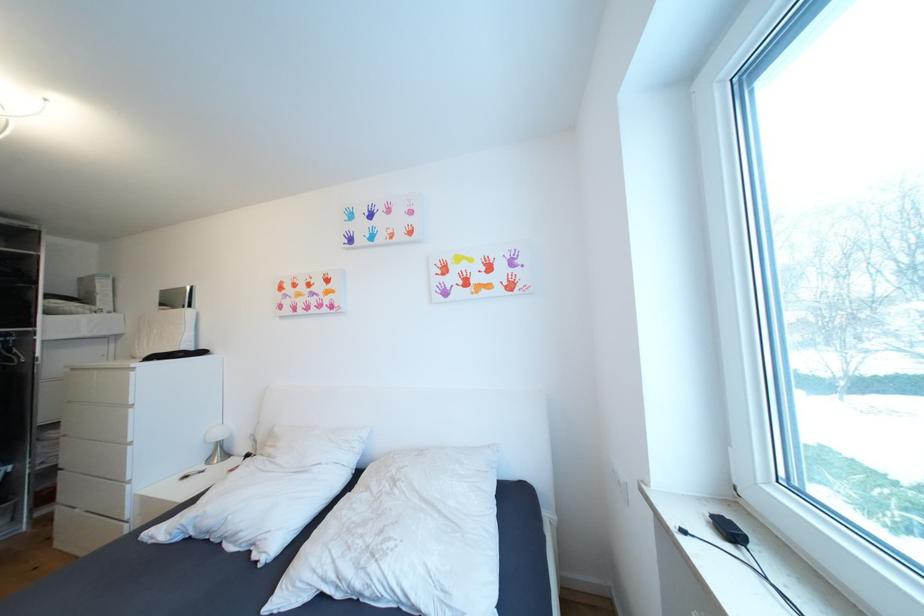
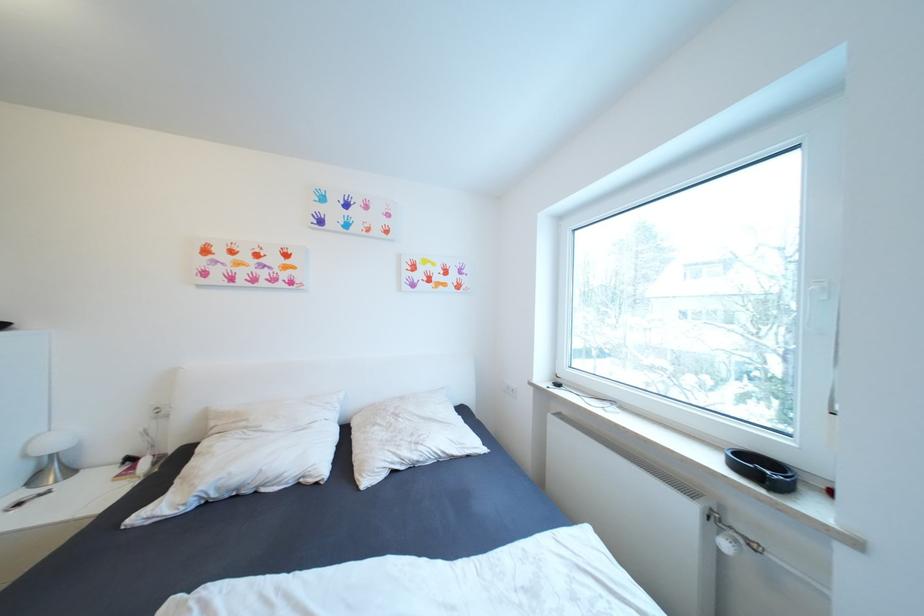
Find the pixel in the second image that matches the point at 402,484 in the first image.

(405, 416)